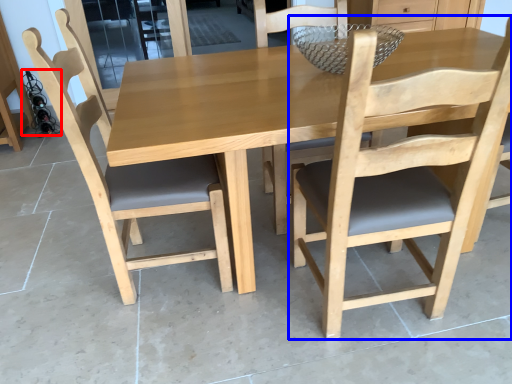
Question: Among these objects, which one is farthest to the camera, wine bottle (highlighted by a red box) or chair (highlighted by a blue box)?

Choices:
 (A) wine bottle
 (B) chair

Answer: (A)